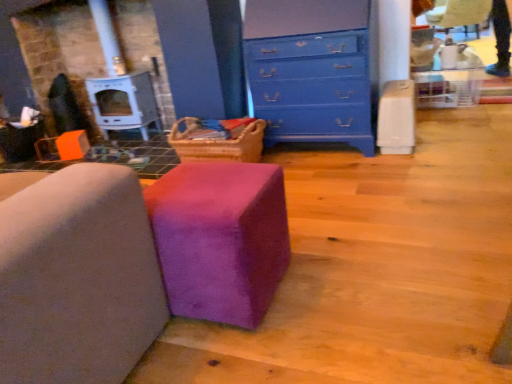
Locate an element on the screen. vacant area located to the right-hand side of purple fuzzy ottoman at center, marked as the second furniture in a left-to-right arrangement is located at coordinates (335, 278).